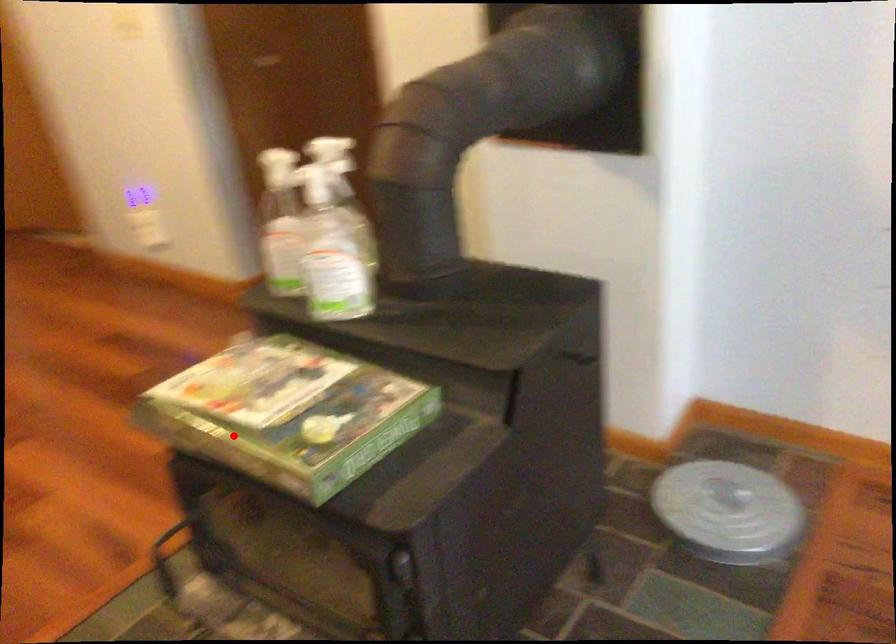
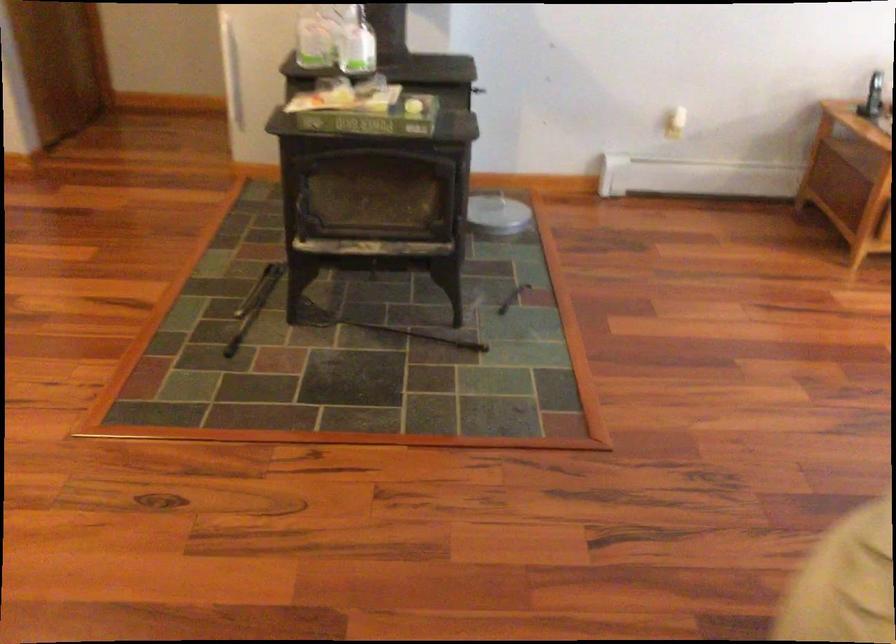
Question: A red point is marked in image1. In image2, is the corresponding 3D point closer to the camera or farther? Reply with the corresponding letter.

Choices:
 (A) The corresponding 3D point is closer.
 (B) The corresponding 3D point is farther.

Answer: (B)